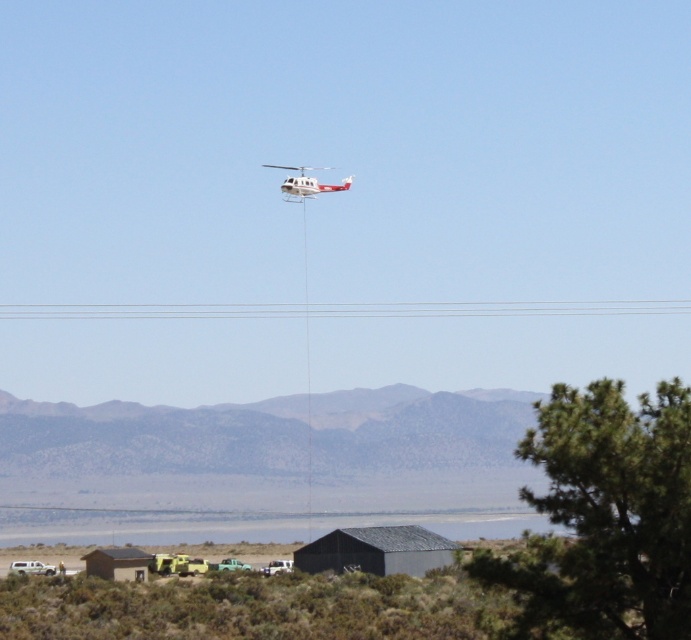
Who is higher up, green grass at lower center or white matte helicopter at upper center?

white matte helicopter at upper center is above.

Does point (53, 513) come in front of point (332, 186)?

No, it is not.

Does point (214, 536) come farther from viewer compared to point (350, 180)?

Yes, it is.

Identify the location of green grass at lower center. The image size is (691, 640). (151, 529).